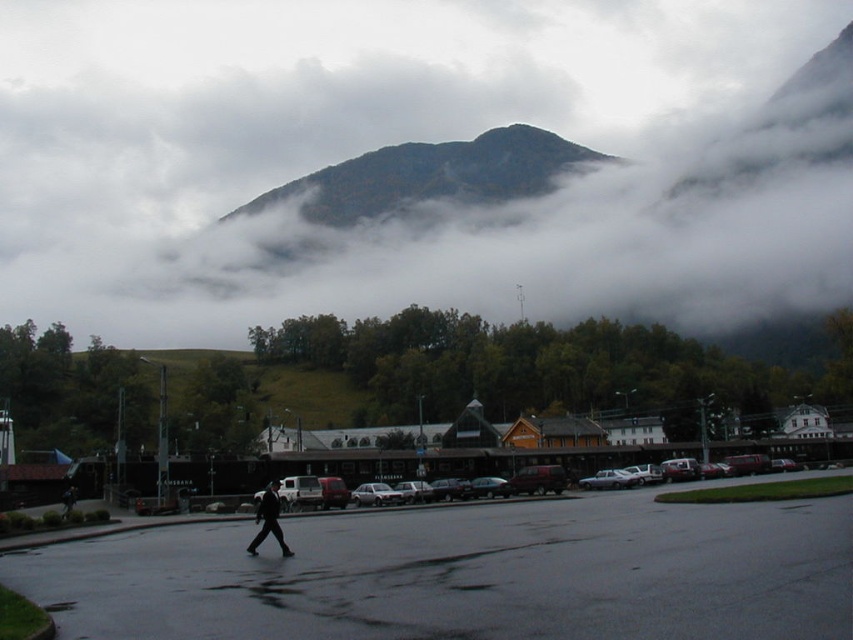
Question: Which point is farther to the camera?

Choices:
 (A) (503, 474)
 (B) (444, 182)
 (C) (274, 506)

Answer: (B)

Question: Which point is farther to the camera?

Choices:
 (A) green forested mountain at upper center
 (B) silver metallic sedan at center

Answer: (A)

Question: Does matte black car at center have a lesser width compared to black matte suit at center?

Choices:
 (A) no
 (B) yes

Answer: (A)

Question: Is matte black car at center positioned at the back of silver metallic sedan at center?

Choices:
 (A) yes
 (B) no

Answer: (B)

Question: Among these points, which one is nearest to the camera?

Choices:
 (A) (270, 497)
 (B) (608, 157)

Answer: (A)

Question: Can you confirm if green forested mountain at upper center is wider than silver metallic sedan at center?

Choices:
 (A) no
 (B) yes

Answer: (B)